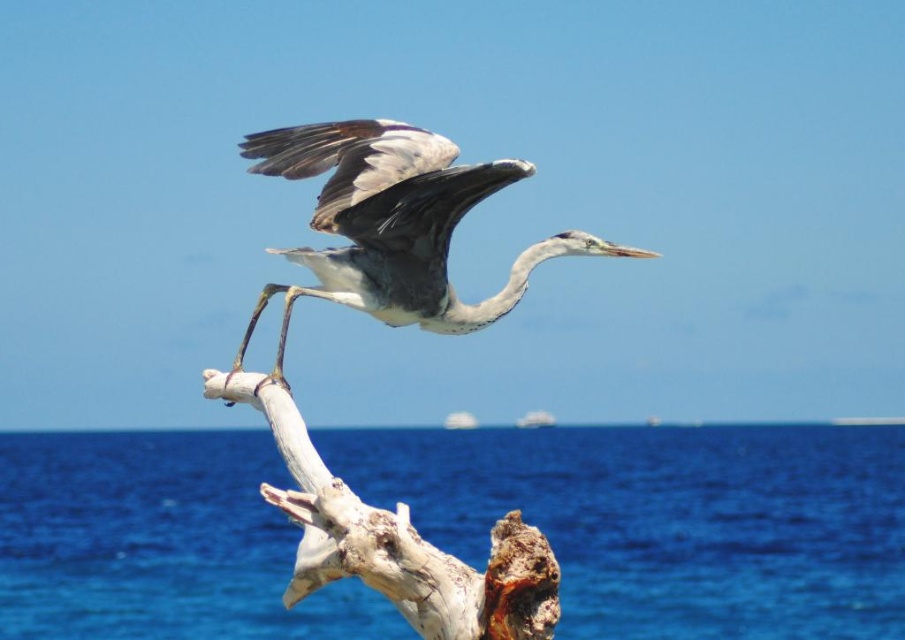
Question: Is blue water at lower center wider than gray feathered heron at center?

Choices:
 (A) yes
 (B) no

Answer: (A)

Question: Which object is the farthest from the gray feathered heron at center?

Choices:
 (A) blue water at lower center
 (B) white rough wood at center

Answer: (A)

Question: Which point appears farthest from the camera in this image?

Choices:
 (A) (406, 282)
 (B) (770, 572)

Answer: (B)

Question: Is blue water at lower center smaller than gray feathered heron at center?

Choices:
 (A) no
 (B) yes

Answer: (A)

Question: Is blue water at lower center smaller than white rough wood at center?

Choices:
 (A) no
 (B) yes

Answer: (A)

Question: Which point is closer to the camera?

Choices:
 (A) (317, 524)
 (B) (732, 596)

Answer: (A)